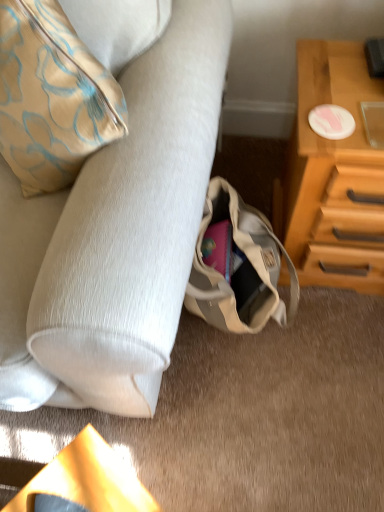
This screenshot has height=512, width=384. Identify the location of wooden chest of drawers at right. (336, 173).

Locate an element on the screen. The height and width of the screenshot is (512, 384). suede-like beige couch at lower left is located at coordinates (116, 236).

Considering the sizes of wooden chest of drawers at right and suede-like beige couch at lower left in the image, is wooden chest of drawers at right bigger or smaller than suede-like beige couch at lower left?

In the image, wooden chest of drawers at right appears to be smaller than suede-like beige couch at lower left.

Is wooden chest of drawers at right positioned with its back to suede-like beige couch at lower left?

No, wooden chest of drawers at right's orientation is not away from suede-like beige couch at lower left.

Is wooden chest of drawers at right not inside suede-like beige couch at lower left?

Absolutely, wooden chest of drawers at right is external to suede-like beige couch at lower left.

From a real-world perspective, is wooden chest of drawers at right located beneath suede-like beige couch at lower left?

Yes, from a real-world perspective, wooden chest of drawers at right is under suede-like beige couch at lower left.

Which object is positioned more to the right, wooden chest of drawers at right or beige canvas bag at lower center?

wooden chest of drawers at right.

Consider the image. Does wooden chest of drawers at right come behind beige canvas bag at lower center?

No, wooden chest of drawers at right is closer to the camera.

Is wooden chest of drawers at right completely or partially outside of beige canvas bag at lower center?

Absolutely, wooden chest of drawers at right is external to beige canvas bag at lower center.

Is point (361, 282) positioned after point (199, 283)?

Yes.

Between suede-like beige couch at lower left and wooden chest of drawers at right, which one appears on the right side from the viewer's perspective?

wooden chest of drawers at right.

Is suede-like beige couch at lower left oriented away from wooden chest of drawers at right?

No, suede-like beige couch at lower left is not facing the opposite direction of wooden chest of drawers at right.

Is point (179, 165) more distant than point (292, 221)?

No, (179, 165) is in front of (292, 221).

Considering the sizes of suede-like beige couch at lower left and wooden chest of drawers at right in the image, is suede-like beige couch at lower left taller or shorter than wooden chest of drawers at right?

Considering their sizes, suede-like beige couch at lower left has more height than wooden chest of drawers at right.

Find the location of a particular element. The image size is (384, 512). handbag located below the wooden chest of drawers at right (from the image's perspective) is located at coordinates (238, 266).

Is beige canvas bag at lower center not near wooden chest of drawers at right?

No, beige canvas bag at lower center is not far away from wooden chest of drawers at right.

Is beige canvas bag at lower center bigger or smaller than wooden chest of drawers at right?

In the image, beige canvas bag at lower center appears to be smaller than wooden chest of drawers at right.

Is beige canvas bag at lower center positioned far away from suede-like beige couch at lower left?

They are positioned close to each other.

Where is `handbag below the suede-like beige couch at lower left (from a real-world perspective)`? This screenshot has width=384, height=512. handbag below the suede-like beige couch at lower left (from a real-world perspective) is located at coordinates (238, 266).

Can you confirm if beige canvas bag at lower center is wider than suede-like beige couch at lower left?

Incorrect, the width of beige canvas bag at lower center does not surpass that of suede-like beige couch at lower left.

From a real-world perspective, is suede-like beige couch at lower left on top of beige canvas bag at lower center?

Yes, from a real-world perspective, suede-like beige couch at lower left is on top of beige canvas bag at lower center.

From the image's perspective, between suede-like beige couch at lower left and beige canvas bag at lower center, who is located below?

beige canvas bag at lower center appears lower in the image.

Is suede-like beige couch at lower left further to the viewer compared to beige canvas bag at lower center?

No, suede-like beige couch at lower left is in front of beige canvas bag at lower center.

Where is `studio couch located on the left of wooden chest of drawers at right`? The width and height of the screenshot is (384, 512). studio couch located on the left of wooden chest of drawers at right is located at coordinates (116, 236).

This screenshot has height=512, width=384. I want to click on handbag below the wooden chest of drawers at right (from a real-world perspective), so click(238, 266).

Based on their spatial positions, is suede-like beige couch at lower left or beige canvas bag at lower center closer to wooden chest of drawers at right?

The object closer to wooden chest of drawers at right is beige canvas bag at lower center.

When comparing their distances from suede-like beige couch at lower left, does beige canvas bag at lower center or wooden chest of drawers at right seem closer?

beige canvas bag at lower center lies closer to suede-like beige couch at lower left than the other object.

Considering their positions, is wooden chest of drawers at right positioned further to suede-like beige couch at lower left than beige canvas bag at lower center?

Among the two, wooden chest of drawers at right is located further to suede-like beige couch at lower left.

Looking at the image, which one is located further to wooden chest of drawers at right, beige canvas bag at lower center or suede-like beige couch at lower left?

Among the two, suede-like beige couch at lower left is located further to wooden chest of drawers at right.

Looking at the image, which one is located closer to beige canvas bag at lower center, suede-like beige couch at lower left or wooden chest of drawers at right?

Among the two, wooden chest of drawers at right is located nearer to beige canvas bag at lower center.

Based on their spatial positions, is wooden chest of drawers at right or suede-like beige couch at lower left further from beige canvas bag at lower center?

suede-like beige couch at lower left.

The width and height of the screenshot is (384, 512). I want to click on handbag between suede-like beige couch at lower left and wooden chest of drawers at right in the horizontal direction, so click(x=238, y=266).